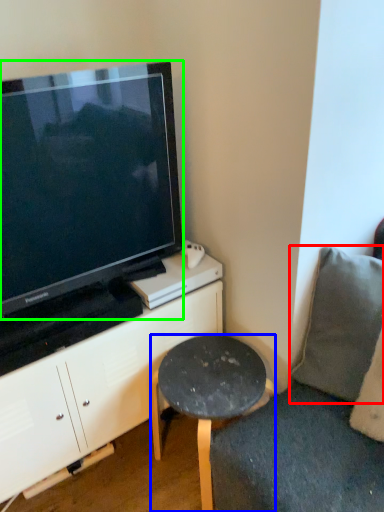
Question: Estimate the real-world distances between objects in this image. Which object is farther from pillow (highlighted by a red box), stool (highlighted by a blue box) or television (highlighted by a green box)?

Choices:
 (A) stool
 (B) television

Answer: (B)